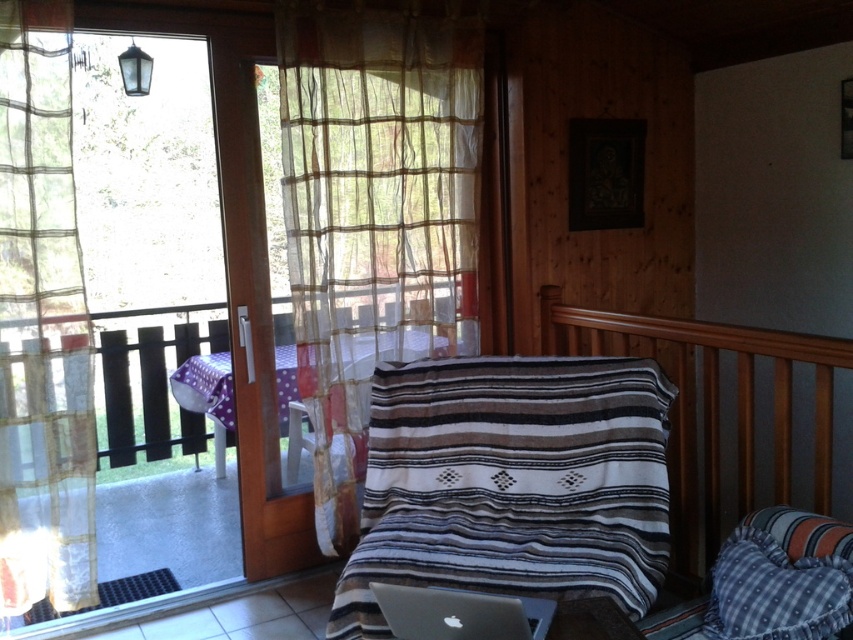
You are arranging a room and need to determine the placement of a new plant. The plant requires indirect sunlight and should be placed where it can receive light from the window without direct exposure. Given the translucent sheer curtain at left and the wooden rail at upper right, which object should the plant be placed near to ensure it gets the required light?

The plant should be placed near the translucent sheer curtain at left because it allows light to filter through, providing indirect sunlight, while the wooden rail at upper right does not block or diffuse light in the same way.

You are trying to decide whether to place your silver metallic laptop at lower center on a table next to the translucent sheer curtain at upper left. If the table is only 30 cm wide, will both items fit side by side?

The translucent sheer curtain at upper left might be wider than the silver metallic laptop at lower center. If the curtain is indeed wider than the laptop, placing both items side by side on a 30 cm wide table may not be possible. You should measure the width of the curtain to confirm.

You are standing in the room and want to reach a specific point marked at coordinates point (55, 554). If your current position is 5 feet away from the glass door, can you comfortably walk to that point without any obstacles?

The distance of point (55, 554) from viewer is 7.93 feet, so since you are currently 5 feet away from the glass door, you can comfortably walk to that point as there are no obstacles mentioned in the scene description.